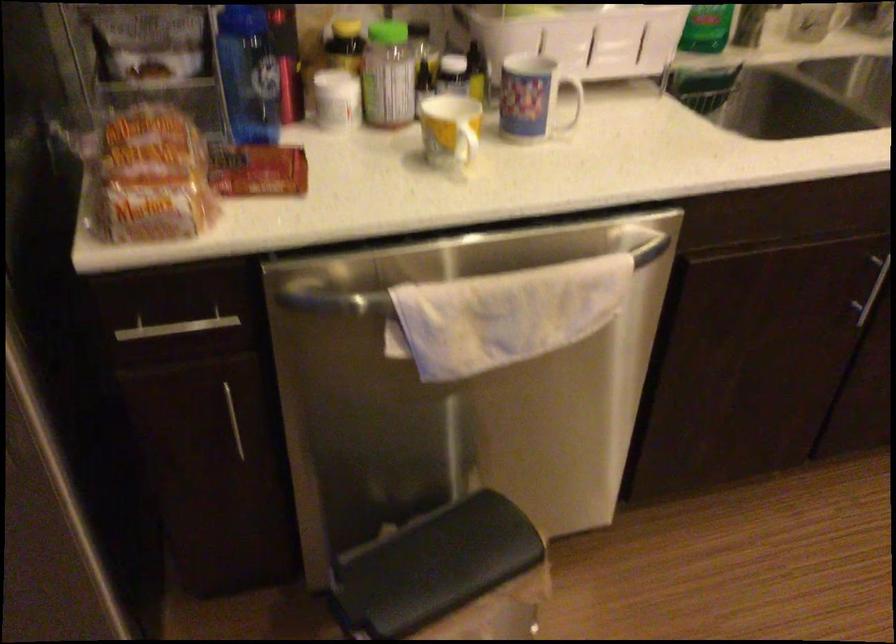
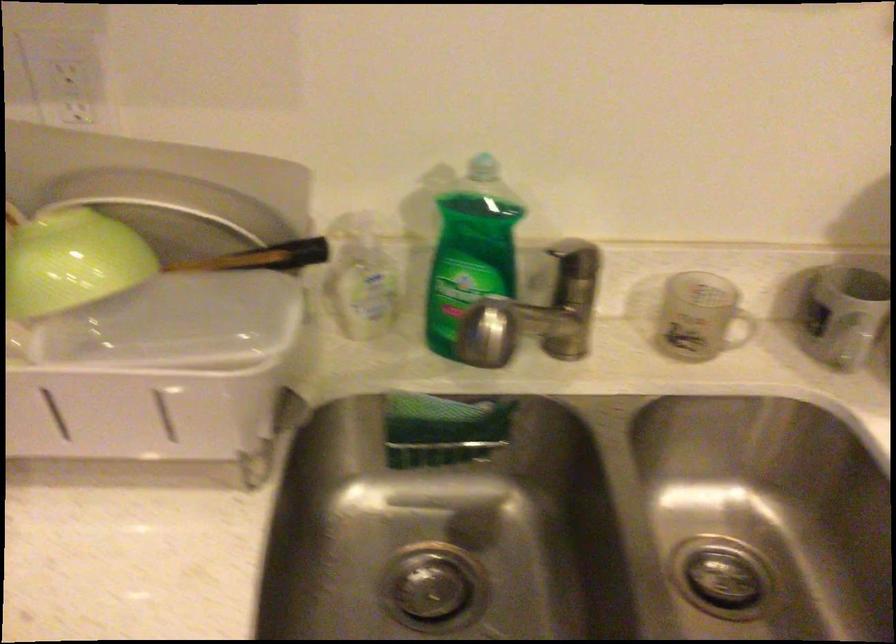
What movement of the cameraman would produce the second image?

The cameraman walked toward right, forward.